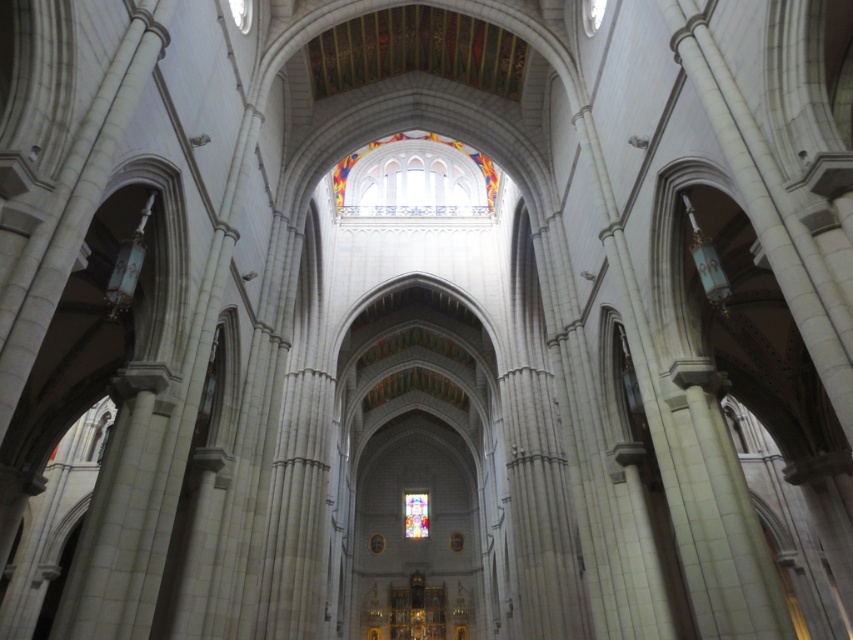
Is stained glass window at center shorter than translucent stained glass at center?

No.

Consider the image. Who is higher up, stained glass window at center or translucent stained glass at center?

stained glass window at center

At what (x,y) coordinates should I click in order to perform the action: click on stained glass window at center. Please return your answer as a coordinate pair (x, y). This screenshot has height=640, width=853. Looking at the image, I should click on (416, 140).